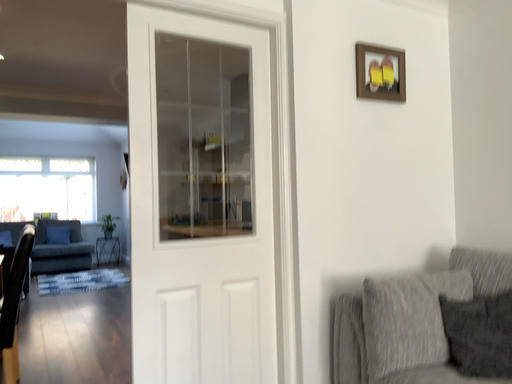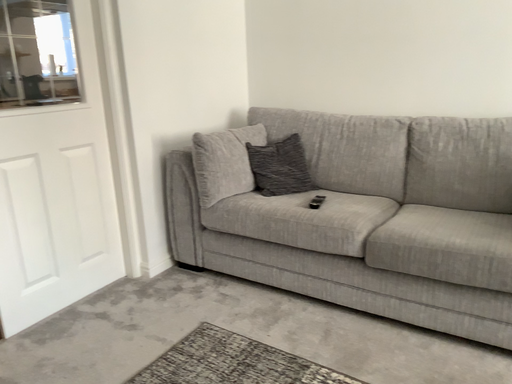
Question: Which way did the camera rotate in the video?

Choices:
 (A) rotated downward
 (B) rotated upward

Answer: (A)